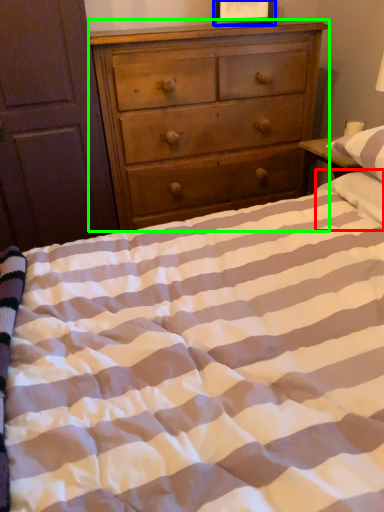
Question: Based on their relative distances, which object is farther from pillow (highlighted by a red box)? Choose from picture frame (highlighted by a blue box) and chest of drawers (highlighted by a green box).

Choices:
 (A) picture frame
 (B) chest of drawers

Answer: (A)